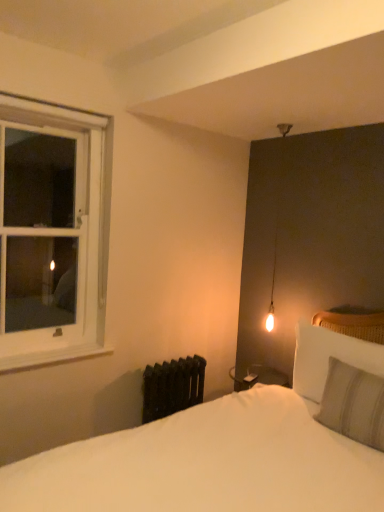
Question: From a real-world perspective, is light gray striped pillow at right, the first pillow viewed from the front, under white soft bed at lower center?

Choices:
 (A) yes
 (B) no

Answer: (B)

Question: Is light gray striped pillow at right, the first pillow viewed from the front, facing away from white soft bed at lower center?

Choices:
 (A) no
 (B) yes

Answer: (B)

Question: From a real-world perspective, is light gray striped pillow at right, the first pillow viewed from the front, over white soft bed at lower center?

Choices:
 (A) no
 (B) yes

Answer: (B)

Question: Considering the relative sizes of light gray striped pillow at right, the first pillow viewed from the front, and white soft bed at lower center in the image provided, is light gray striped pillow at right, the first pillow viewed from the front, smaller than white soft bed at lower center?

Choices:
 (A) yes
 (B) no

Answer: (A)

Question: Is light gray striped pillow at right, the first pillow viewed from the front, not inside white soft bed at lower center?

Choices:
 (A) no
 (B) yes

Answer: (A)

Question: Can you confirm if light gray striped pillow at right, the first pillow viewed from the front, is thinner than white soft bed at lower center?

Choices:
 (A) yes
 (B) no

Answer: (A)

Question: Can you confirm if white soft bed at lower center is positioned to the right of white wooden window at left?

Choices:
 (A) no
 (B) yes

Answer: (B)

Question: From a real-world perspective, is white soft bed at lower center physically below white wooden window at left?

Choices:
 (A) yes
 (B) no

Answer: (A)

Question: Is white soft bed at lower center further to the viewer compared to white wooden window at left?

Choices:
 (A) no
 (B) yes

Answer: (A)

Question: From the image's perspective, is white soft bed at lower center below white wooden window at left?

Choices:
 (A) yes
 (B) no

Answer: (A)

Question: Does white soft bed at lower center appear on the left side of white wooden window at left?

Choices:
 (A) no
 (B) yes

Answer: (A)

Question: From a real-world perspective, is white soft bed at lower center on white wooden window at left?

Choices:
 (A) no
 (B) yes

Answer: (A)

Question: Considering the relative positions of black cast iron radiator at lower left and white painted wood at left in the image provided, is black cast iron radiator at lower left to the left of white painted wood at left from the viewer's perspective?

Choices:
 (A) yes
 (B) no

Answer: (B)